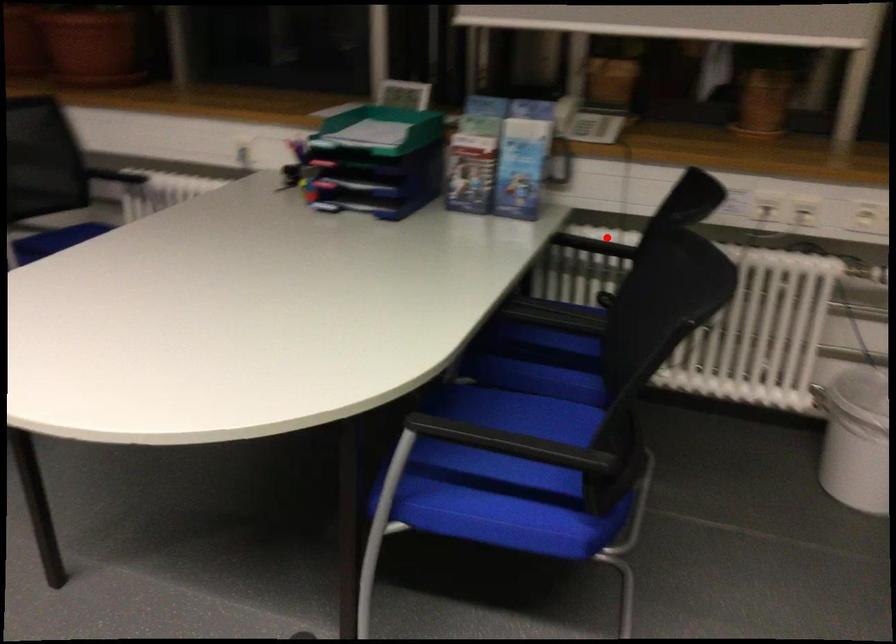
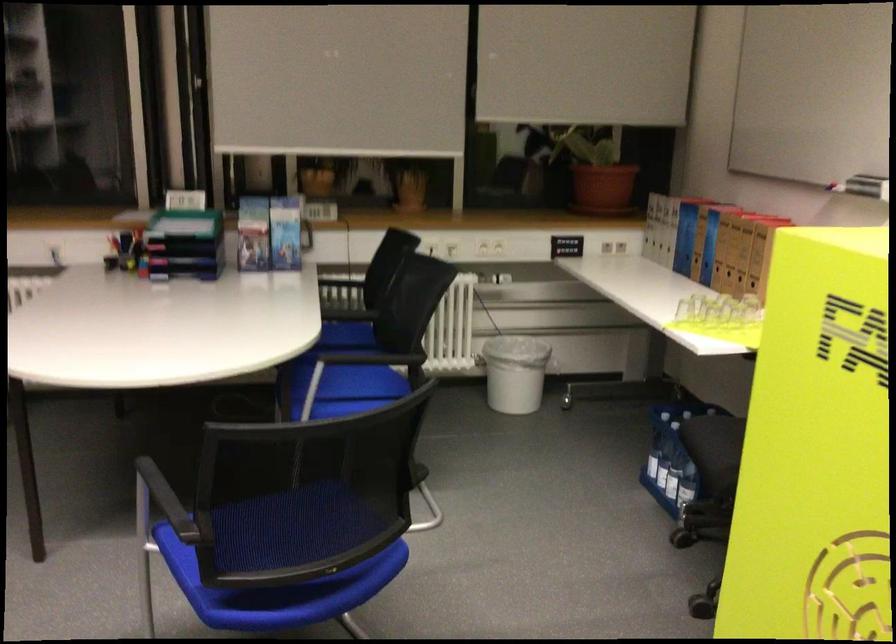
Where in the second image is the point corresponding to the highlighted location from the first image?

(340, 279)